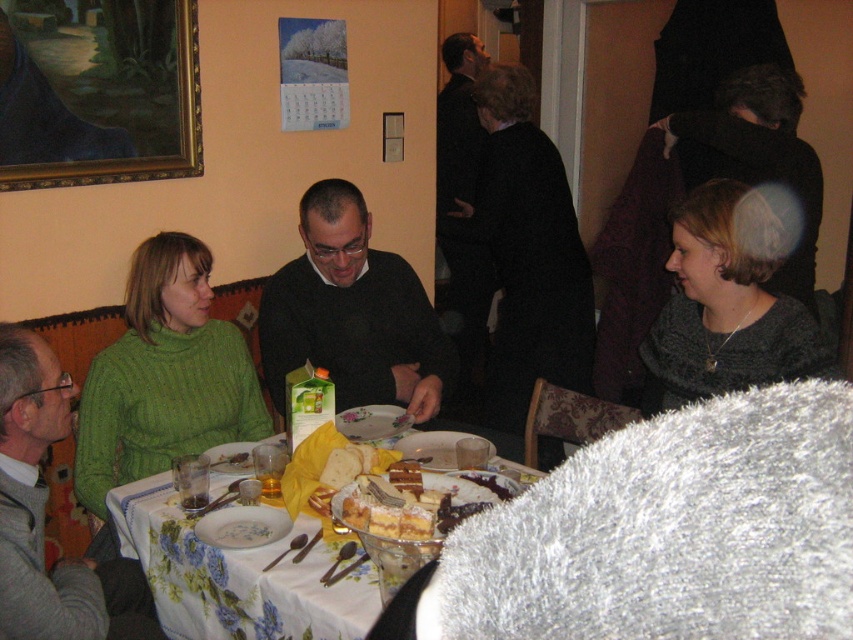
Question: In this image, where is dark green sweater at center located relative to smooth white plate at center?

Choices:
 (A) above
 (B) below

Answer: (A)

Question: Is black woolen sweater at upper center positioned in front of black matte suit at upper center?

Choices:
 (A) yes
 (B) no

Answer: (A)

Question: Among these points, which one is farthest from the camera?

Choices:
 (A) (166, 483)
 (B) (231, 456)
 (C) (306, 195)

Answer: (C)

Question: Which object is closer to the camera taking this photo?

Choices:
 (A) dark gray knit scarf at right
 (B) smooth white plate at center
 (C) wooden framed painting at upper left
 (D) dark green sweater at center

Answer: (A)

Question: In this image, where is green knitted sweater at left located relative to porcelain bowl at center?

Choices:
 (A) left
 (B) right

Answer: (A)

Question: Which object is farther from the camera taking this photo?

Choices:
 (A) floral tablecloth at center
 (B) porcelain bowl at center
 (C) green knitted sweater at left

Answer: (C)